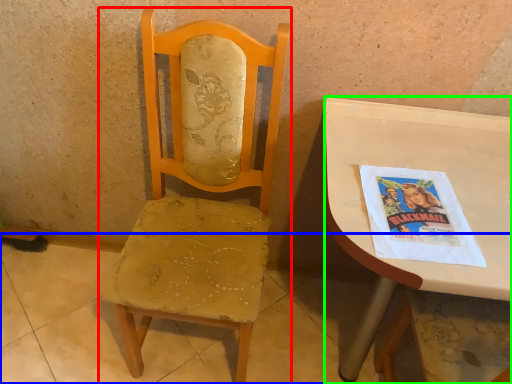
Question: Which object is positioned closest to chair (highlighted by a red box)? Select from concrete (highlighted by a blue box) and desk (highlighted by a green box).

Choices:
 (A) concrete
 (B) desk

Answer: (B)